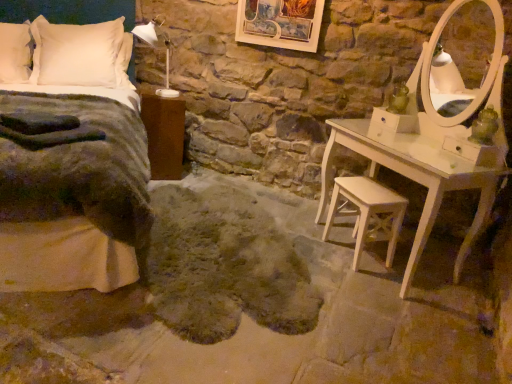
Question: Is point (309, 26) closer or farther from the camera than point (154, 173)?

Choices:
 (A) farther
 (B) closer

Answer: (B)

Question: Is wooden picture frame at upper center situated inside brown wood nightstand at left or outside?

Choices:
 (A) inside
 (B) outside

Answer: (B)

Question: Based on their relative distances, which object is nearer to the wooden picture frame at upper center?

Choices:
 (A) velvet grey blanket at left
 (B) white soft pillow at upper left, placed as the 1th pillow when sorted from left to right
 (C) white soft pillow at upper left, arranged as the first pillow when viewed from the right
 (D) brown wood nightstand at left
 (E) white plastic lamp at upper left

Answer: (E)

Question: Which of these objects is positioned farthest from the white soft pillow at upper left, placed as the 1th pillow when sorted from left to right?

Choices:
 (A) velvet grey blanket at left
 (B) fuzzy gray rug at center
 (C) white soft pillow at upper left, arranged as the first pillow when viewed from the right
 (D) white plastic lamp at upper left
 (E) brown wood nightstand at left

Answer: (B)